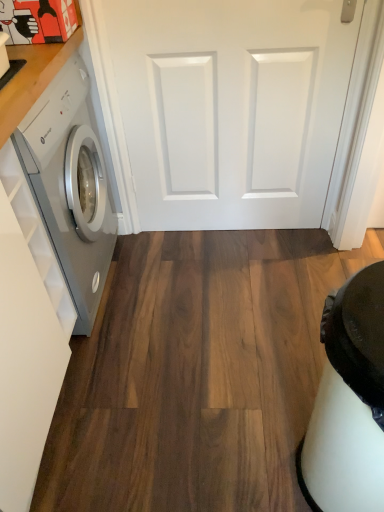
The height and width of the screenshot is (512, 384). I want to click on vacant area that lies in front of white matte door at center, so click(236, 294).